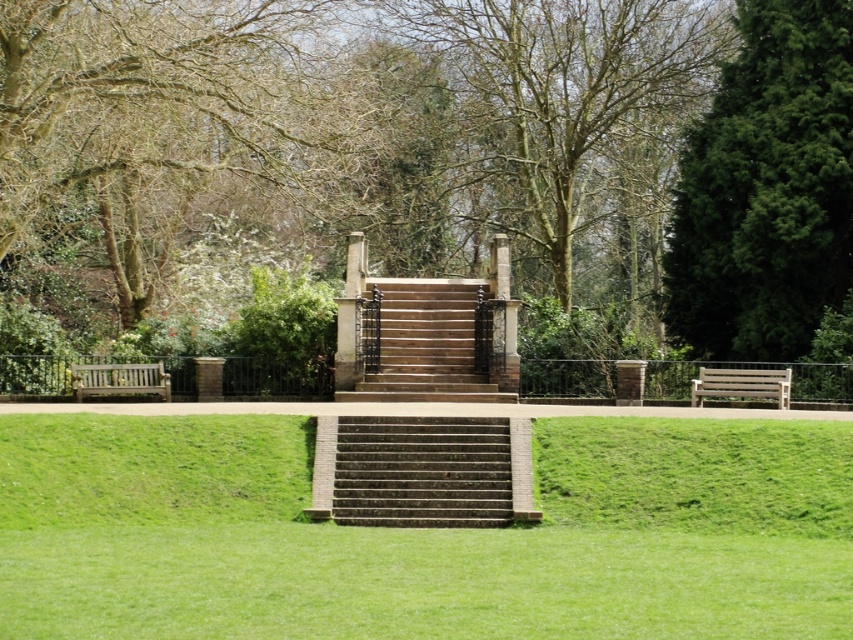
You are a visitor at the park and want to sit down to rest. You see the brown stone stairs at center and the wooden bench at right. Which one is bigger in size?

The brown stone stairs at center is larger in size than wooden bench at right.

You are standing at the monument and want to find the green textured tree at right. In which direction should you look to see it?

The green textured tree at right is located to your right side, so you should look to your right to see it.